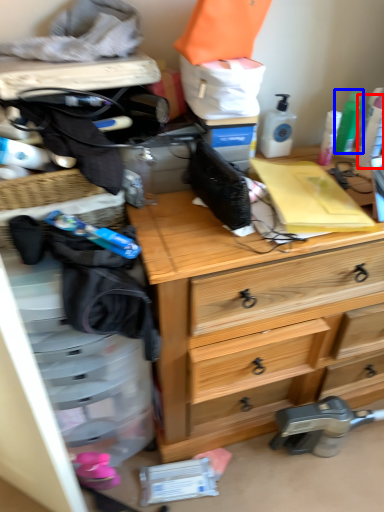
Question: Among these objects, which one is farthest to the camera, toiletry (highlighted by a red box) or toiletry (highlighted by a blue box)?

Choices:
 (A) toiletry
 (B) toiletry

Answer: (B)